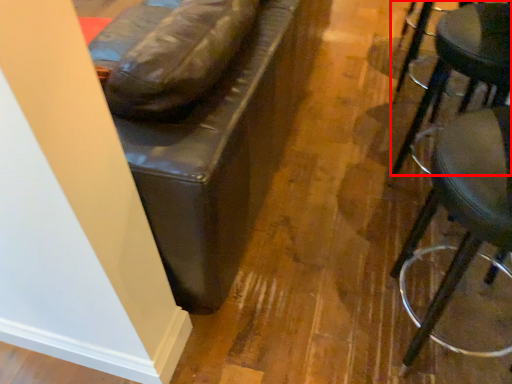
Question: From the image's perspective, considering the relative positions of stool (annotated by the red box) and stool in the image provided, where is stool (annotated by the red box) located with respect to the staircase?

Choices:
 (A) below
 (B) above

Answer: (B)